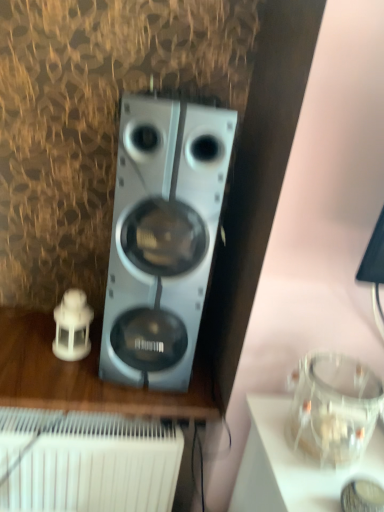
Question: In terms of height, does satin silver speaker at center look taller or shorter compared to white plastic speaker at left?

Choices:
 (A) short
 (B) tall

Answer: (B)

Question: Considering the relative positions of satin silver speaker at center and white plastic speaker at left in the image provided, is satin silver speaker at center to the left or to the right of white plastic speaker at left?

Choices:
 (A) left
 (B) right

Answer: (B)

Question: Which is farther from the white plastic speaker at left?

Choices:
 (A) satin silver speaker at center
 (B) white plastic radiator at lower left

Answer: (A)

Question: Which of these objects is positioned farthest from the white plastic speaker at left?

Choices:
 (A) white plastic radiator at lower left
 (B) satin silver speaker at center

Answer: (B)